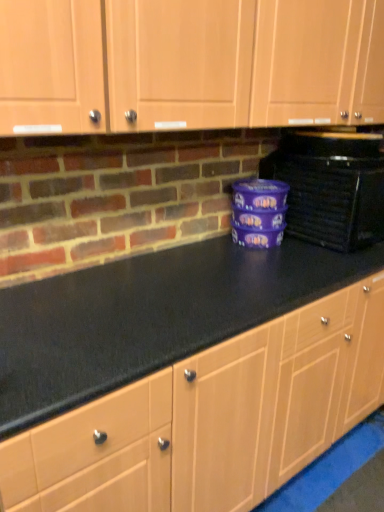
The image size is (384, 512). What are the coordinates of `matte wood cabinets at upper center` in the screenshot? It's located at (244, 63).

What do you see at coordinates (244, 63) in the screenshot? I see `matte wood cabinets at upper center` at bounding box center [244, 63].

What do you see at coordinates (331, 187) in the screenshot? I see `black plastic toaster oven at right` at bounding box center [331, 187].

In order to click on black plastic toaster oven at right in this screenshot , I will do `click(331, 187)`.

What is the approximate width of black plastic toaster oven at right?

The width of black plastic toaster oven at right is 50.49 centimeters.

At what (x,y) coordinates should I click in order to perform the action: click on matte wood cabinets at upper center. Please return your answer as a coordinate pair (x, y). Looking at the image, I should click on (244, 63).

Which object is positioned more to the right, matte wood cabinets at upper center or black plastic toaster oven at right?

black plastic toaster oven at right is more to the right.

Is the depth of matte wood cabinets at upper center greater than that of black plastic toaster oven at right?

No, matte wood cabinets at upper center is closer to the camera.

Is point (273, 3) positioned after point (292, 175)?

No, (273, 3) is in front of (292, 175).

From the image's perspective, is matte wood cabinets at upper center positioned above or below black plastic toaster oven at right?

matte wood cabinets at upper center is situated higher than black plastic toaster oven at right in the image.

From a real-world perspective, is matte wood cabinets at upper center positioned under black plastic toaster oven at right based on gravity?

No.

Which of these two, matte wood cabinets at upper center or black plastic toaster oven at right, is thinner?

With smaller width is matte wood cabinets at upper center.

Considering the relative sizes of matte wood cabinets at upper center and black plastic toaster oven at right in the image provided, is matte wood cabinets at upper center shorter than black plastic toaster oven at right?

No, matte wood cabinets at upper center is not shorter than black plastic toaster oven at right.

Considering the relative sizes of matte wood cabinets at upper center and black plastic toaster oven at right in the image provided, is matte wood cabinets at upper center bigger than black plastic toaster oven at right?

Indeed, matte wood cabinets at upper center has a larger size compared to black plastic toaster oven at right.

Could black plastic toaster oven at right be considered to be inside matte wood cabinets at upper center?

No.

Is there a large distance between matte wood cabinets at upper center and black plastic toaster oven at right?

They are positioned close to each other.

Does matte wood cabinets at upper center turn towards black plastic toaster oven at right?

→ No, matte wood cabinets at upper center is not facing towards black plastic toaster oven at right.

What's the angular difference between matte wood cabinets at upper center and black plastic toaster oven at right's facing directions?

0.364 degrees separate the facing orientations of matte wood cabinets at upper center and black plastic toaster oven at right.

Locate an element on the screen. home appliance below the matte wood cabinets at upper center (from the image's perspective) is located at coordinates (331, 187).

Considering the relative positions of black plastic toaster oven at right and matte wood cabinets at upper center in the image provided, is black plastic toaster oven at right to the right of matte wood cabinets at upper center from the viewer's perspective?

Yes, black plastic toaster oven at right is to the right of matte wood cabinets at upper center.

From the picture: Is black plastic toaster oven at right in front of matte wood cabinets at upper center?

That is False.

Is point (312, 202) positioned after point (48, 4)?

Yes, it is behind point (48, 4).

From the image's perspective, is black plastic toaster oven at right located above or below matte wood cabinets at upper center?

black plastic toaster oven at right is situated lower than matte wood cabinets at upper center in the image.

From a real-world perspective, who is located higher, black plastic toaster oven at right or matte wood cabinets at upper center?

matte wood cabinets at upper center is physically above.

Can you confirm if black plastic toaster oven at right is wider than matte wood cabinets at upper center?

Yes.

Can you confirm if black plastic toaster oven at right is shorter than matte wood cabinets at upper center?

Yes, black plastic toaster oven at right is shorter than matte wood cabinets at upper center.

Can you confirm if black plastic toaster oven at right is bigger than matte wood cabinets at upper center?

No.

Would you say black plastic toaster oven at right is outside matte wood cabinets at upper center?

Yes.

Is black plastic toaster oven at right not near matte wood cabinets at upper center?

Actually, black plastic toaster oven at right and matte wood cabinets at upper center are a little close together.

Is black plastic toaster oven at right oriented away from matte wood cabinets at upper center?

No, matte wood cabinets at upper center is not at the back of black plastic toaster oven at right.

What's the angular difference between black plastic toaster oven at right and matte wood cabinets at upper center's facing directions?

There is a 0.364-degree angle between the facing directions of black plastic toaster oven at right and matte wood cabinets at upper center.

How distant is black plastic toaster oven at right from matte wood cabinets at upper center?

black plastic toaster oven at right and matte wood cabinets at upper center are 16.36 inches apart from each other.

You are a GUI agent. You are given a task and a screenshot of the screen. Output one action in this format:
    pyautogui.click(x=<x>, y=<y>)
    Task: Click on the home appliance below the matte wood cabinets at upper center (from a real-world perspective)
    
    Given the screenshot: What is the action you would take?
    pyautogui.click(x=331, y=187)

Identify the location of cabinetry that appears above the black plastic toaster oven at right (from a real-world perspective). This screenshot has width=384, height=512. (244, 63).

This screenshot has width=384, height=512. What are the coordinates of `home appliance beneath the matte wood cabinets at upper center (from a real-world perspective)` in the screenshot? It's located at (331, 187).